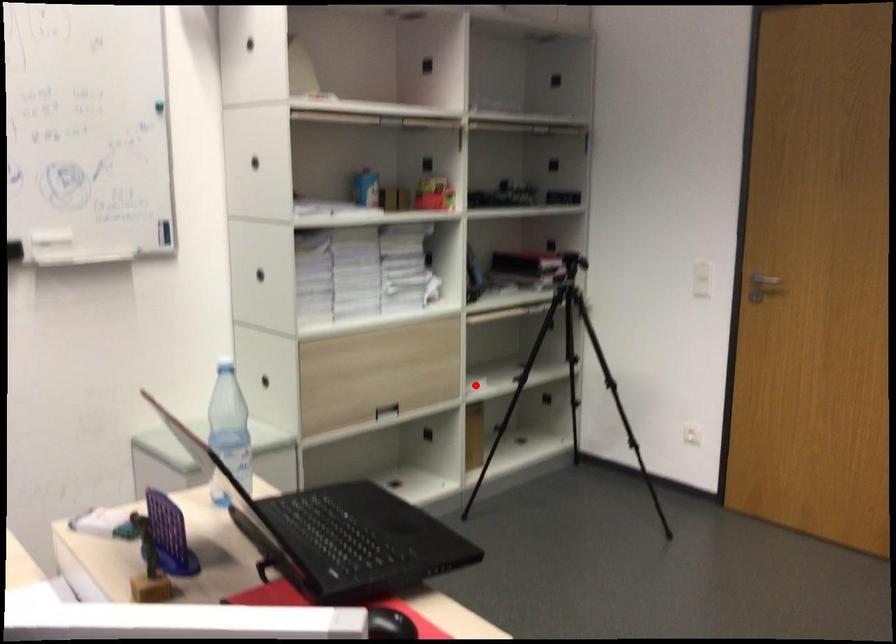
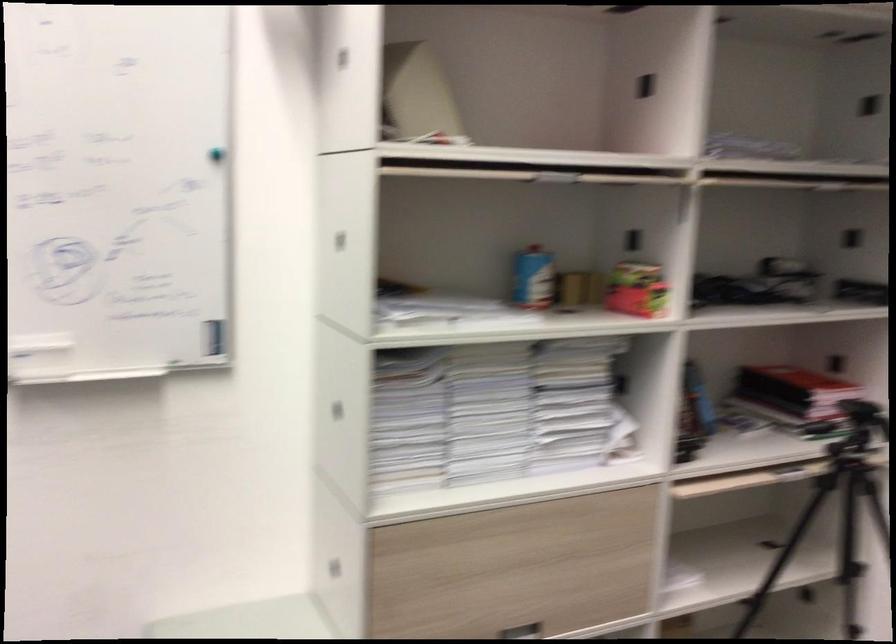
Locate, in the second image, the point that corresponds to the highlighted location in the first image.

(678, 581)